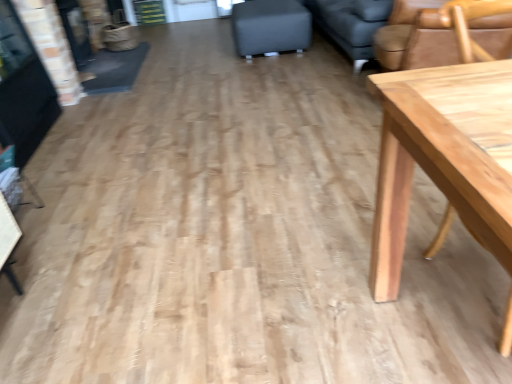
Question: Considering the positions of light brown wood chair at upper right and matte black ottoman at center in the image, is light brown wood chair at upper right bigger or smaller than matte black ottoman at center?

Choices:
 (A) big
 (B) small

Answer: (A)

Question: Considering the positions of point (457, 56) and point (289, 28), is point (457, 56) closer or farther from the camera than point (289, 28)?

Choices:
 (A) farther
 (B) closer

Answer: (B)

Question: From a real-world perspective, is light brown wood chair at upper right physically located above or below matte black ottoman at center?

Choices:
 (A) above
 (B) below

Answer: (A)

Question: Is matte black ottoman at center situated inside light brown wood chair at upper right or outside?

Choices:
 (A) inside
 (B) outside

Answer: (B)

Question: Is matte black ottoman at center taller or shorter than light brown wood chair at upper right?

Choices:
 (A) short
 (B) tall

Answer: (A)

Question: Would you say matte black ottoman at center is to the left or to the right of light brown wood chair at upper right in the picture?

Choices:
 (A) left
 (B) right

Answer: (A)

Question: In the image, is matte black ottoman at center positioned in front of or behind light brown wood chair at upper right?

Choices:
 (A) behind
 (B) front

Answer: (A)